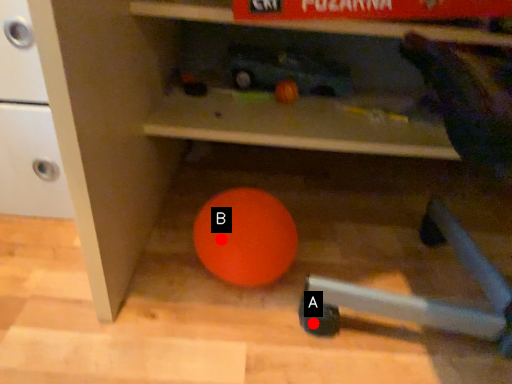
Question: Two points are circled on the image, labeled by A and B beside each circle. Which point appears farthest from the camera in this image?

Choices:
 (A) A is further
 (B) B is further

Answer: (B)